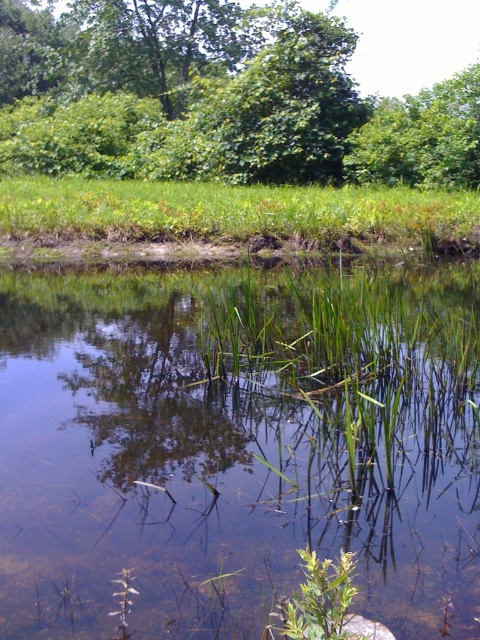
You are standing at the edge of the pond and notice a point marked at coordinates (237, 449). Based on the scene description, what does this point likely represent?

The point at (237, 449) indicates clear water at center, so it likely represents the area where the water is most transparent and free of obstructions.

You are standing at the edge of the water and want to walk towards the green leafy tree at upper center. Which direction should you head relative to the green grass at center?

You should head to the left of the green grass at center because the green leafy tree at upper center is located to the left of it.

You are a frog sitting on the green grass at center. You want to jump to the clear water at center. Is the water at center lower than the grass you are on?

The clear water at center is not as tall as green grass at center, so yes, the water is lower than the grass you are on.